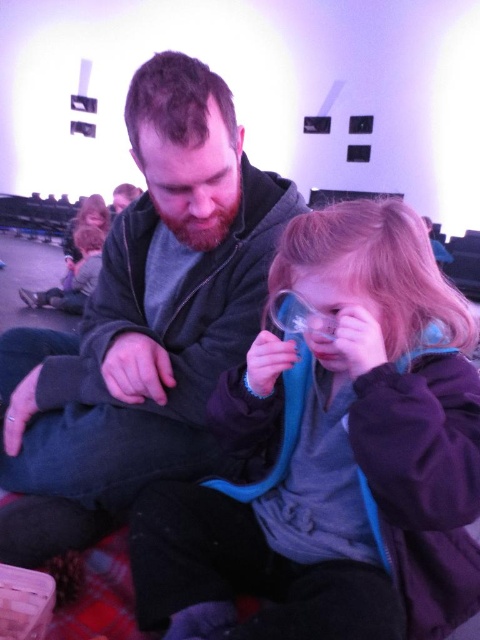
Looking at this image, can you confirm if dark gray hoodie at center is positioned above transparent plastic goggles at center?

Indeed, dark gray hoodie at center is positioned over transparent plastic goggles at center.

Is dark gray hoodie at center positioned before transparent plastic goggles at center?

No, dark gray hoodie at center is further to the viewer.

Find the location of `dark gray hoodie at center`. dark gray hoodie at center is located at coordinates (143, 323).

Is purple fleece jacket at center above transparent plastic goggles at center?

No, purple fleece jacket at center is not above transparent plastic goggles at center.

Which is in front, point (336, 218) or point (295, 312)?

Point (336, 218) is more forward.

Who is more distant from viewer, [343,504] or [300,332]?

Point [343,504]

In order to click on purple fleece jacket at center in this screenshot , I will do `click(334, 456)`.

In the scene shown: Is purple fleece jacket at center positioned at the back of dark gray hoodie at center?

No, purple fleece jacket at center is in front of dark gray hoodie at center.

Between purple fleece jacket at center and dark gray hoodie at center, which one has more height?

dark gray hoodie at center

This screenshot has width=480, height=640. I want to click on purple fleece jacket at center, so click(334, 456).